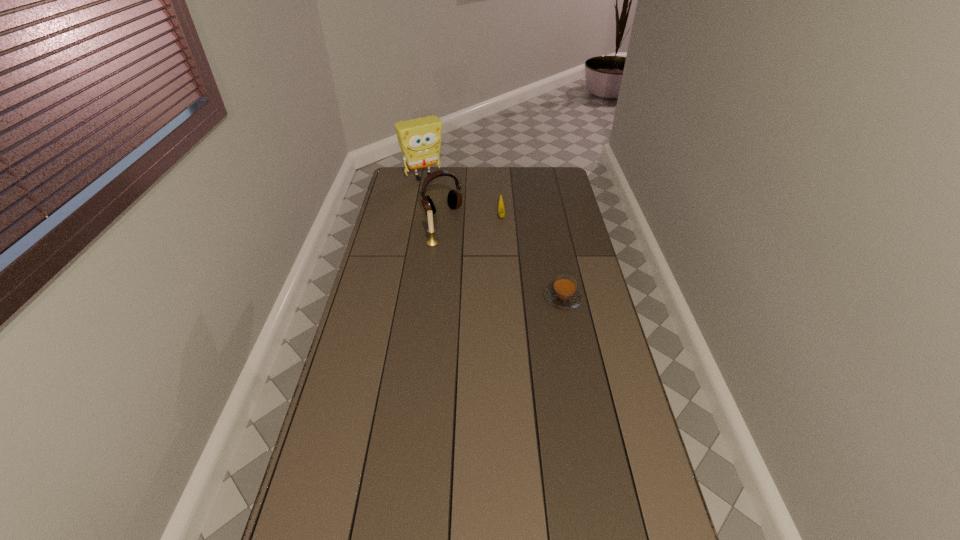
I want to click on the third shortest object, so click(x=431, y=241).

At what (x,y) coordinates should I click in order to perform the action: click on candle holder. Please return your answer as a coordinate pair (x, y). This screenshot has height=540, width=960. Looking at the image, I should click on (431, 241).

Where is `the rightmost object`? The width and height of the screenshot is (960, 540). the rightmost object is located at coordinates (563, 294).

The image size is (960, 540). Find the location of `the nearest object`. the nearest object is located at coordinates (563, 294).

The image size is (960, 540). In order to click on the second object from right to left in this screenshot , I will do `click(501, 210)`.

Where is `the tallest object`? Image resolution: width=960 pixels, height=540 pixels. the tallest object is located at coordinates (419, 139).

I want to click on the farthest object, so click(x=419, y=139).

The image size is (960, 540). Identify the location of headset. coord(454,199).

Locate an element on the screen. The width and height of the screenshot is (960, 540). free spot located 0.130m on the left of the third shortest object is located at coordinates (396, 243).

I want to click on vacant region located on the back of the nearest object, so click(555, 256).